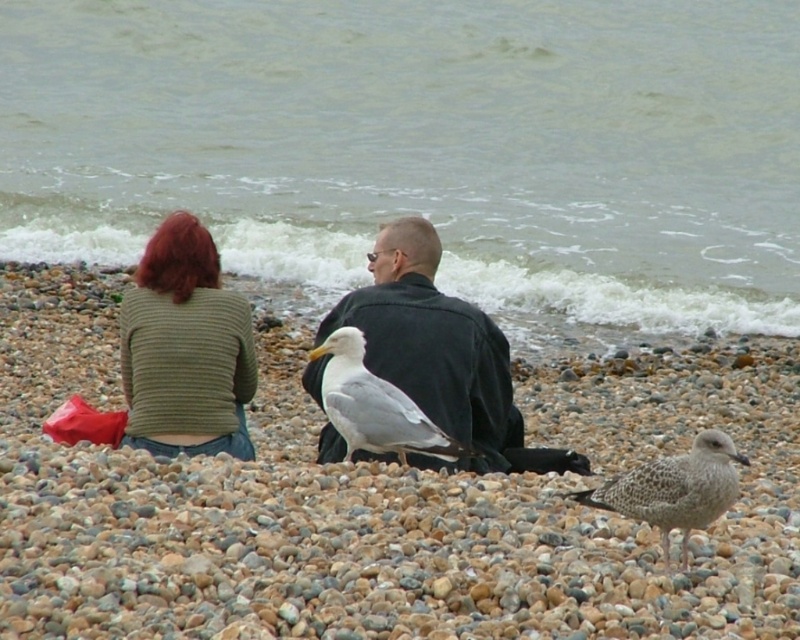
Which is in front, point (488, 467) or point (698, 484)?

Positioned in front is point (698, 484).

Does black matte jacket at center have a lesser height compared to speckled feathered seagull at lower right?

Incorrect, black matte jacket at center's height does not fall short of speckled feathered seagull at lower right's.

This screenshot has width=800, height=640. What do you see at coordinates (440, 353) in the screenshot? I see `black matte jacket at center` at bounding box center [440, 353].

Locate an element on the screen. This screenshot has height=640, width=800. black matte jacket at center is located at coordinates (440, 353).

From the picture: Between gray water at center and green knitted sweater at lower left, which one has less height?

green knitted sweater at lower left

Is point (720, 16) farther from camera compared to point (169, 333)?

Yes, it is.

The height and width of the screenshot is (640, 800). Describe the element at coordinates (425, 148) in the screenshot. I see `gray water at center` at that location.

This screenshot has height=640, width=800. I want to click on gray water at center, so click(x=425, y=148).

Is gray water at center above black matte jacket at center?

Yes.

Between gray water at center and black matte jacket at center, which one is positioned lower?

black matte jacket at center is below.

What do you see at coordinates (425, 148) in the screenshot? I see `gray water at center` at bounding box center [425, 148].

You are a GUI agent. You are given a task and a screenshot of the screen. Output one action in this format:
    pyautogui.click(x=<x>, y=<y>)
    Task: Click on the gray water at center
    
    Given the screenshot: What is the action you would take?
    pyautogui.click(x=425, y=148)